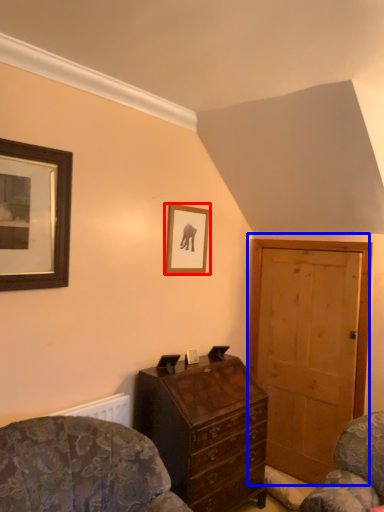
Question: Which of the following is the farthest to the observer, picture frame (highlighted by a red box) or door (highlighted by a blue box)?

Choices:
 (A) picture frame
 (B) door

Answer: (B)